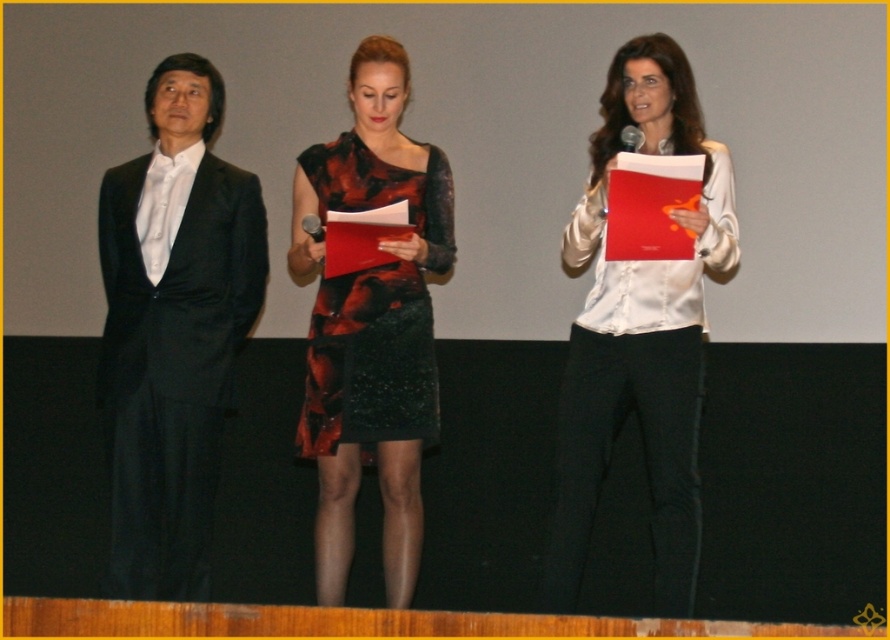
Question: Considering the relative positions of white satin blouse at center and matte black suit at left in the image provided, where is white satin blouse at center located with respect to matte black suit at left?

Choices:
 (A) above
 (B) below

Answer: (A)

Question: Which point is closer to the camera?

Choices:
 (A) matte black suit at left
 (B) black textured dress at center
 (C) white satin blouse at center

Answer: (C)

Question: Which point is closer to the camera?

Choices:
 (A) (411, 445)
 (B) (198, 420)
 (C) (619, 403)

Answer: (C)

Question: Does white satin blouse at center have a greater width compared to matte black suit at left?

Choices:
 (A) no
 (B) yes

Answer: (A)

Question: Which point is farther to the camera?

Choices:
 (A) white satin blouse at center
 (B) black textured dress at center
 (C) matte black suit at left

Answer: (C)

Question: Is black textured dress at center to the right of matte black suit at left from the viewer's perspective?

Choices:
 (A) no
 (B) yes

Answer: (B)